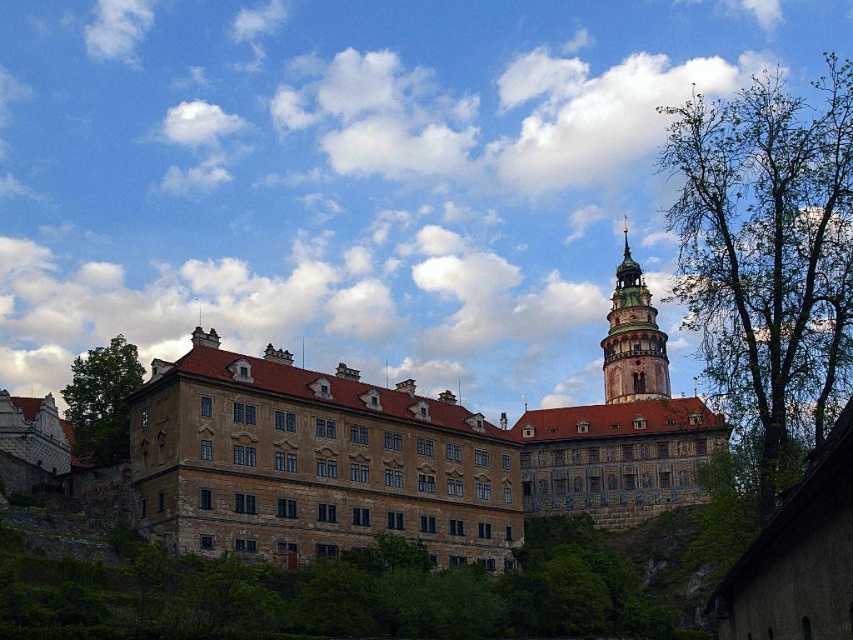
Question: Which is farther from the brown stone castle at center?

Choices:
 (A) green leafy tree at right
 (B) green leafy tree at left
 (C) green wooden tower at upper center

Answer: (B)

Question: Does green leafy tree at left appear on the right side of green wooden tower at upper center?

Choices:
 (A) yes
 (B) no

Answer: (B)

Question: Considering the relative positions of green leafy tree at right and green wooden tower at upper center in the image provided, where is green leafy tree at right located with respect to green wooden tower at upper center?

Choices:
 (A) below
 (B) above

Answer: (B)

Question: Among these objects, which one is nearest to the camera?

Choices:
 (A) brown stone castle at center
 (B) green leafy tree at right
 (C) green wooden tower at upper center
 (D) green leafy tree at left

Answer: (B)

Question: Does brown stone castle at center have a larger size compared to green wooden tower at upper center?

Choices:
 (A) no
 (B) yes

Answer: (B)

Question: Which point appears farthest from the camera in this image?

Choices:
 (A) (103, 353)
 (B) (634, 387)
 (C) (663, 474)

Answer: (B)